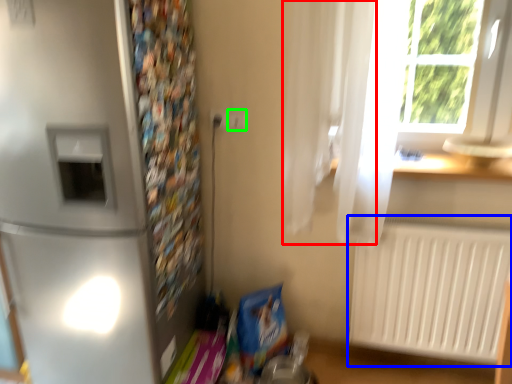
Question: Which object is the closest to the curtain (highlighted by a red box)? Choose among these: radiator (highlighted by a blue box) or electric outlet (highlighted by a green box).

Choices:
 (A) radiator
 (B) electric outlet

Answer: (B)